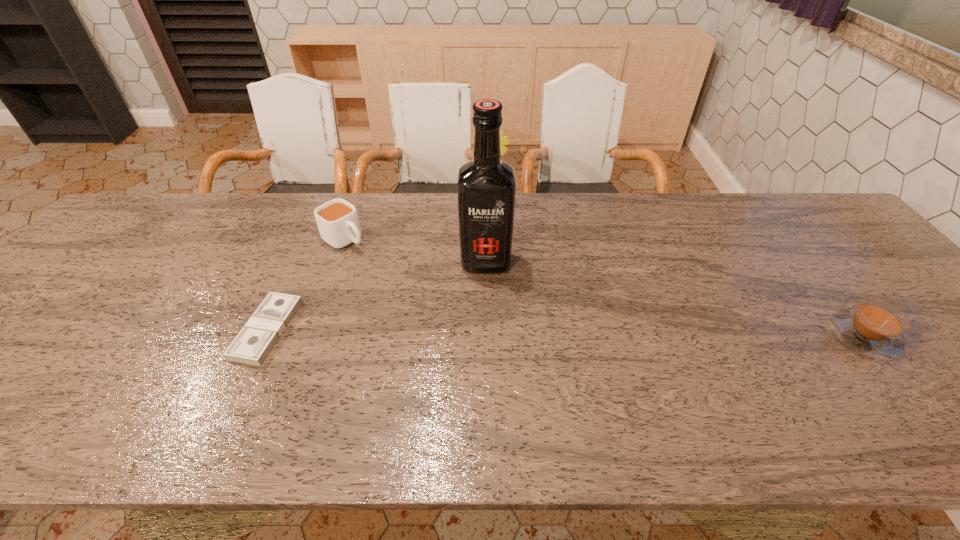
The image size is (960, 540). I want to click on object that is at the right edge, so click(873, 328).

Identify the location of blank space at the far edge of the desktop. (273, 200).

I want to click on vacant space at the near edge, so click(276, 376).

Where is `vacant space at the left edge`? This screenshot has height=540, width=960. vacant space at the left edge is located at coordinates (115, 242).

This screenshot has height=540, width=960. What are the coordinates of `free region at the right edge` in the screenshot? It's located at (904, 333).

The image size is (960, 540). I want to click on vacant space that is in between the cappuccino and the dollar, so click(x=565, y=333).

At what (x,y) coordinates should I click in order to perform the action: click on free spot between the liquor and the rightmost object. Please return your answer as a coordinate pair (x, y). Looking at the image, I should click on (674, 299).

Where is `vacant space that is in between the second tallest object and the cup`? This screenshot has height=540, width=960. vacant space that is in between the second tallest object and the cup is located at coordinates (419, 221).

The image size is (960, 540). I want to click on free spot between the third shortest object and the farthest object, so click(419, 221).

This screenshot has height=540, width=960. I want to click on free spot between the rightmost object and the tallest object, so click(x=674, y=299).